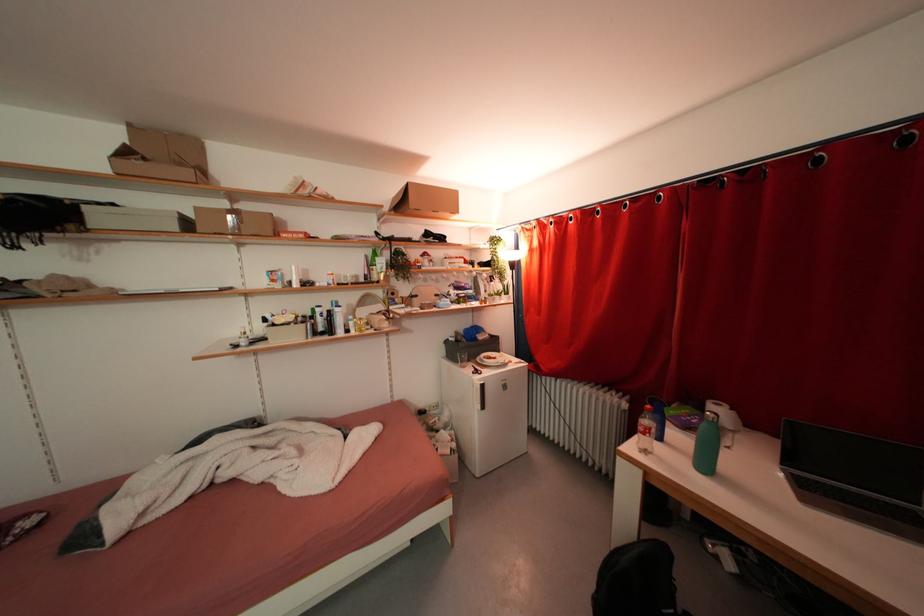
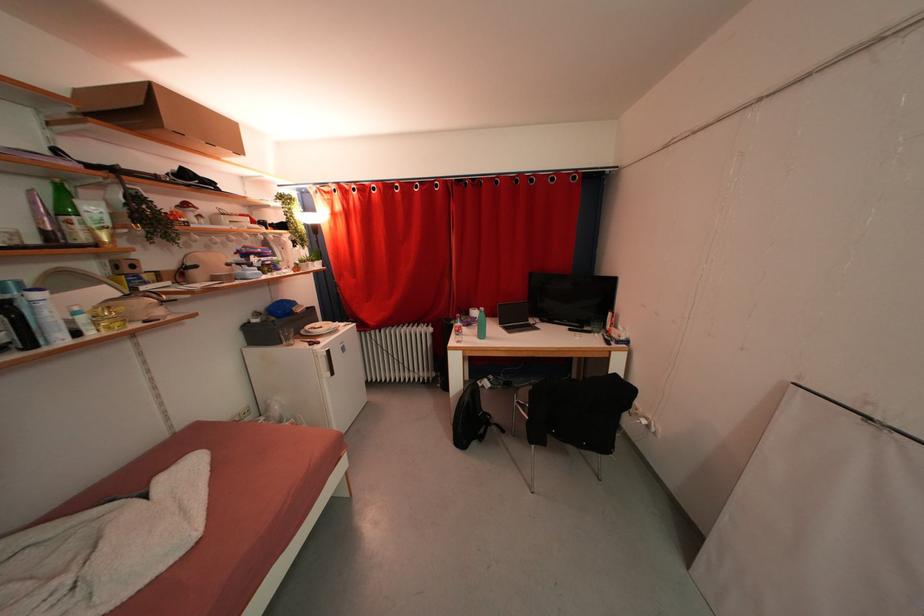
Where in the second image is the point corresponding to (381,281) from the first image?

(89, 241)